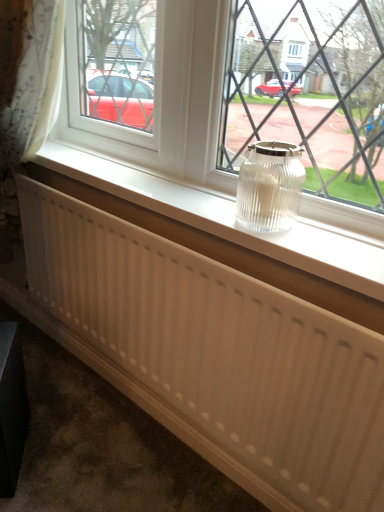
Question: Is white plastic radiator at center turned away from white ribbed radiator at center?

Choices:
 (A) no
 (B) yes

Answer: (A)

Question: Is white plastic radiator at center positioned behind white ribbed radiator at center?

Choices:
 (A) yes
 (B) no

Answer: (A)

Question: Is white plastic radiator at center to the right of white ribbed radiator at center from the viewer's perspective?

Choices:
 (A) no
 (B) yes

Answer: (B)

Question: Is white plastic radiator at center facing towards white ribbed radiator at center?

Choices:
 (A) no
 (B) yes

Answer: (A)

Question: From a real-world perspective, is white plastic radiator at center located higher than white ribbed radiator at center?

Choices:
 (A) yes
 (B) no

Answer: (A)

Question: From a real-world perspective, is white ribbed radiator at center above or below clear glass jar at center?

Choices:
 (A) below
 (B) above

Answer: (A)

Question: From the image's perspective, is white ribbed radiator at center positioned above or below clear glass jar at center?

Choices:
 (A) above
 (B) below

Answer: (B)

Question: Is white ribbed radiator at center in front of or behind clear glass jar at center in the image?

Choices:
 (A) behind
 (B) front

Answer: (A)

Question: In terms of size, does white ribbed radiator at center appear bigger or smaller than clear glass jar at center?

Choices:
 (A) big
 (B) small

Answer: (B)

Question: From a real-world perspective, relative to white plastic radiator at center, is white ribbed radiator at center vertically above or below?

Choices:
 (A) above
 (B) below

Answer: (B)

Question: Considering the positions of white ribbed radiator at center and white plastic radiator at center in the image, is white ribbed radiator at center taller or shorter than white plastic radiator at center?

Choices:
 (A) short
 (B) tall

Answer: (B)

Question: Is point (205, 292) positioned closer to the camera than point (382, 264)?

Choices:
 (A) closer
 (B) farther

Answer: (B)

Question: Is white ribbed radiator at center to the left or to the right of white plastic radiator at center in the image?

Choices:
 (A) right
 (B) left

Answer: (B)

Question: Based on their sizes in the image, would you say clear glass jar at center is bigger or smaller than clear glass jar at center?

Choices:
 (A) small
 (B) big

Answer: (A)

Question: From their relative heights in the image, would you say clear glass jar at center is taller or shorter than clear glass jar at center?

Choices:
 (A) tall
 (B) short

Answer: (B)